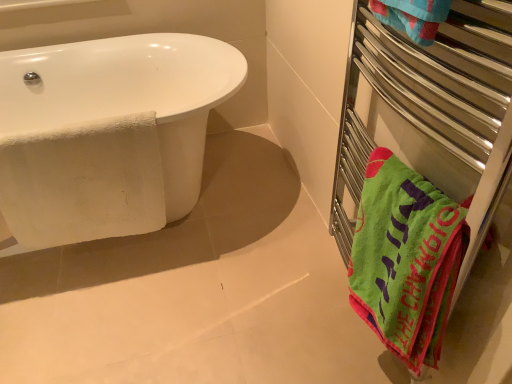
Question: Is white textured towel at left to the left of white glossy bathtub at left from the viewer's perspective?

Choices:
 (A) no
 (B) yes

Answer: (A)

Question: Is white textured towel at left looking in the opposite direction of white glossy bathtub at left?

Choices:
 (A) no
 (B) yes

Answer: (B)

Question: From a real-world perspective, is white textured towel at left located beneath white glossy bathtub at left?

Choices:
 (A) no
 (B) yes

Answer: (A)

Question: From the image's perspective, is white textured towel at left on white glossy bathtub at left?

Choices:
 (A) yes
 (B) no

Answer: (B)

Question: Is white textured towel at left smaller than white glossy bathtub at left?

Choices:
 (A) no
 (B) yes

Answer: (B)

Question: Is white textured towel at left in front of or behind green fabric towel at right in the image?

Choices:
 (A) front
 (B) behind

Answer: (B)

Question: Looking at their shapes, would you say white textured towel at left is wider or thinner than green fabric towel at right?

Choices:
 (A) wide
 (B) thin

Answer: (B)

Question: Based on their positions, is white textured towel at left located to the left or right of green fabric towel at right?

Choices:
 (A) left
 (B) right

Answer: (A)

Question: In terms of size, does white textured towel at left appear bigger or smaller than green fabric towel at right?

Choices:
 (A) small
 (B) big

Answer: (A)

Question: Based on their sizes in the image, would you say green fabric towel at right is bigger or smaller than green soft towel at right?

Choices:
 (A) small
 (B) big

Answer: (B)

Question: From the image's perspective, is green fabric towel at right positioned above or below green soft towel at right?

Choices:
 (A) below
 (B) above

Answer: (B)

Question: Does point (370, 142) appear closer or farther from the camera than point (410, 283)?

Choices:
 (A) closer
 (B) farther

Answer: (B)

Question: From a real-world perspective, is green fabric towel at right physically located above or below green soft towel at right?

Choices:
 (A) above
 (B) below

Answer: (A)

Question: From the image's perspective, relative to green soft towel at right, is white textured towel at left above or below?

Choices:
 (A) below
 (B) above

Answer: (B)

Question: Based on their sizes in the image, would you say white textured towel at left is bigger or smaller than green soft towel at right?

Choices:
 (A) small
 (B) big

Answer: (A)